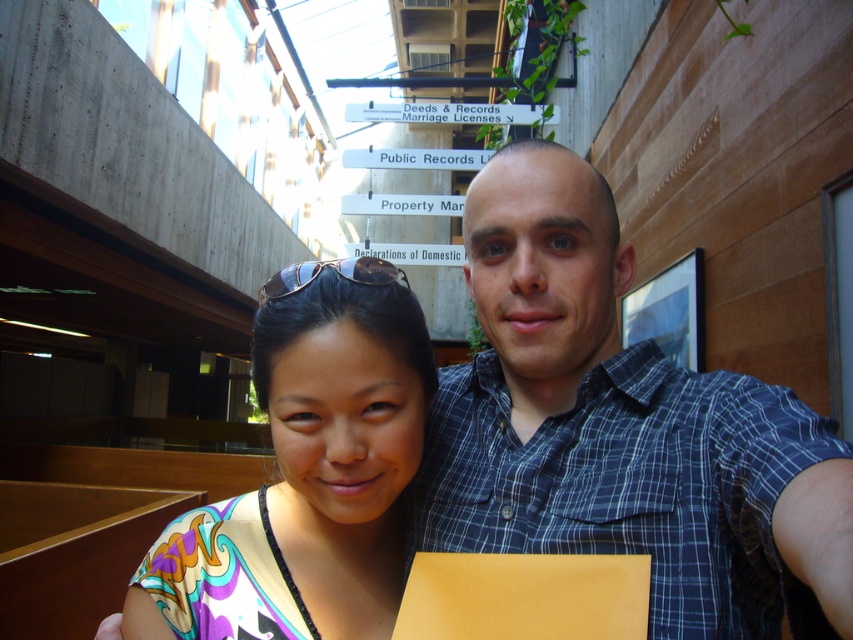
You are a photographer trying to capture the blue plaid shirt at center and the multicolored fabric at center in a single frame. Based on their positions, which one is covering part of the other?

The blue plaid shirt at center is positioned over multicolored fabric at center, so it is covering part of it.

You are an interior designer assessing the decor of this space. The multicolored fabric at center and black plastic sunglasses at upper center are part of the decor. Which object is placed lower in the scene?

The multicolored fabric at center is positioned under the black plastic sunglasses at upper center, so it is placed lower in the scene.

You are a photographer trying to capture a photo of the blue plaid shirt at center and the black plastic sunglasses at upper center. Which object should you focus on first if you want to ensure both are in focus, considering their sizes in the frame?

The blue plaid shirt at center is much taller than the black plastic sunglasses at upper center, so you should focus on the blue plaid shirt at center first to ensure both are in focus.